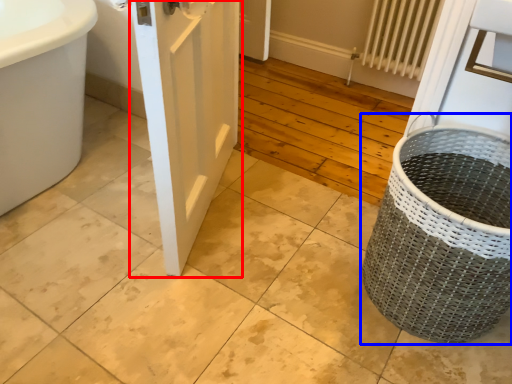
Question: Which point is further to the camera, door (highlighted by a red box) or basket container (highlighted by a blue box)?

Choices:
 (A) door
 (B) basket container

Answer: (B)